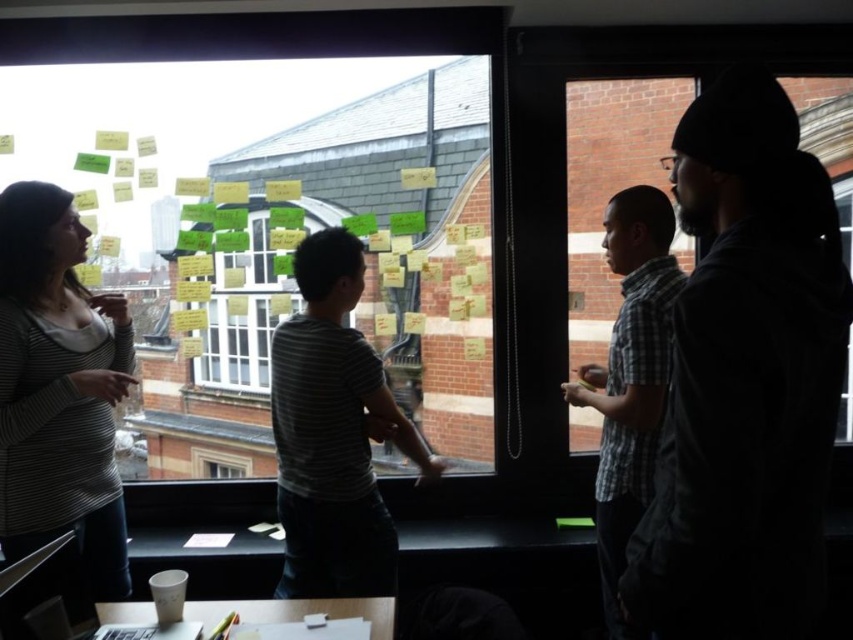
You are part of the brainstorming group and need to move to the left side of the room to grab a whiteboard marker. Which participant should you pass first, the dark gray hoodie at right or the plaid cotton shirt at right?

You should pass the plaid cotton shirt at right first because the dark gray hoodie at right is positioned to its right, meaning the plaid cotton shirt at right is closer to the left side of the room.

You are standing in the office and want to take a photo of the point at coordinates point (219, 323). The camera you are using has a focal length of 50mm and a sensor size of 24mm. What is the minimum distance you need to move closer to ensure the point fills the camera sensor completely?

To calculate the minimum distance required, use the formula distance equals sensor size divided by two times the tangent of half the focal length angle. The focal length angle can be calculated using arctangent of sensor size divided by two times focal length. Plugging in the numbers, the minimum distance needed is approximately 2.58 meters. Since the point is already at 2.58 meters from the camera, you donot need to move closer.

You are standing in the office and see the striped fabric shirt at left and the transparent glass window at center. Which object is taller?

The striped fabric shirt at left is taller than the transparent glass window at center.